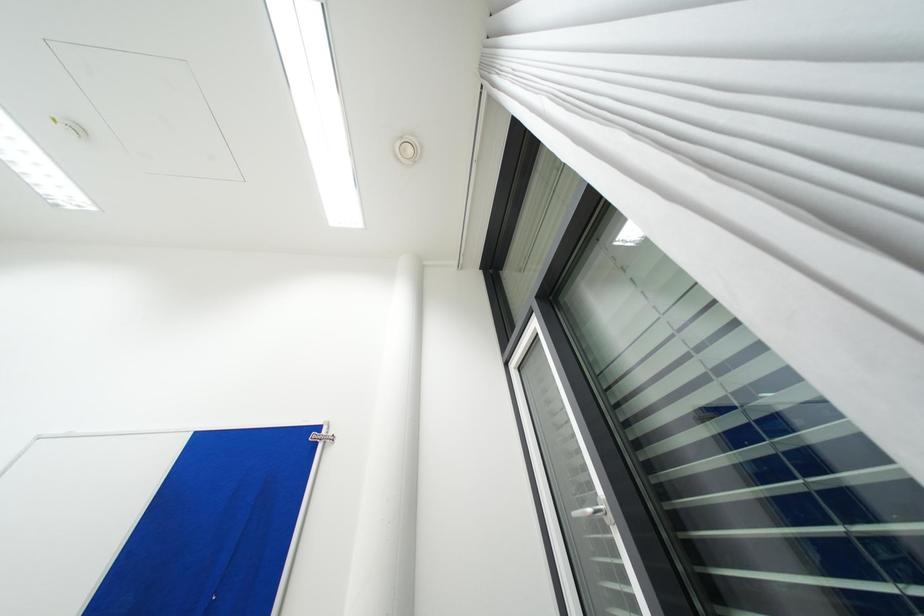
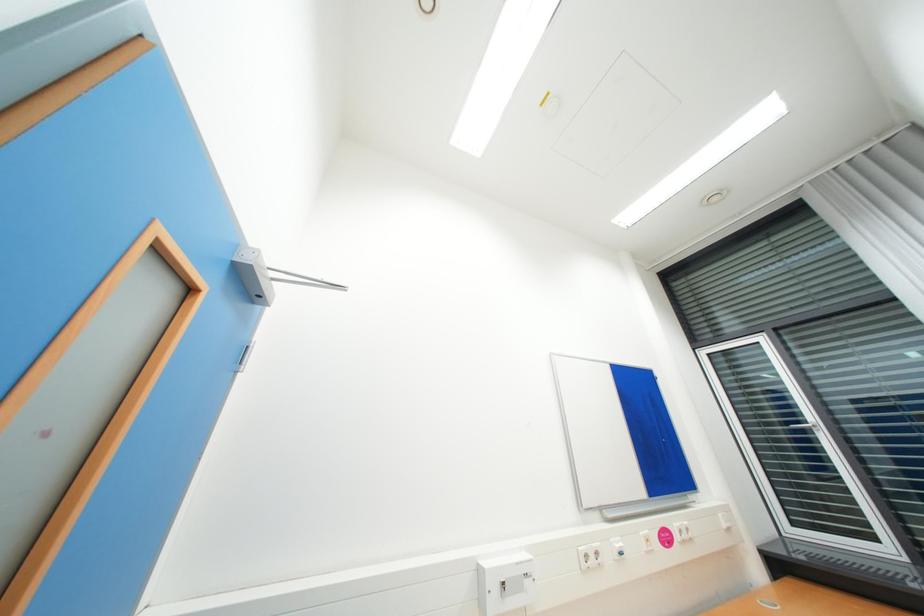
Question: Which direction would the cameraman need to move to produce the second image? Reply with the corresponding letter.

Choices:
 (A) Left
 (B) Right
 (C) Forward
 (D) Backward

Answer: (A)